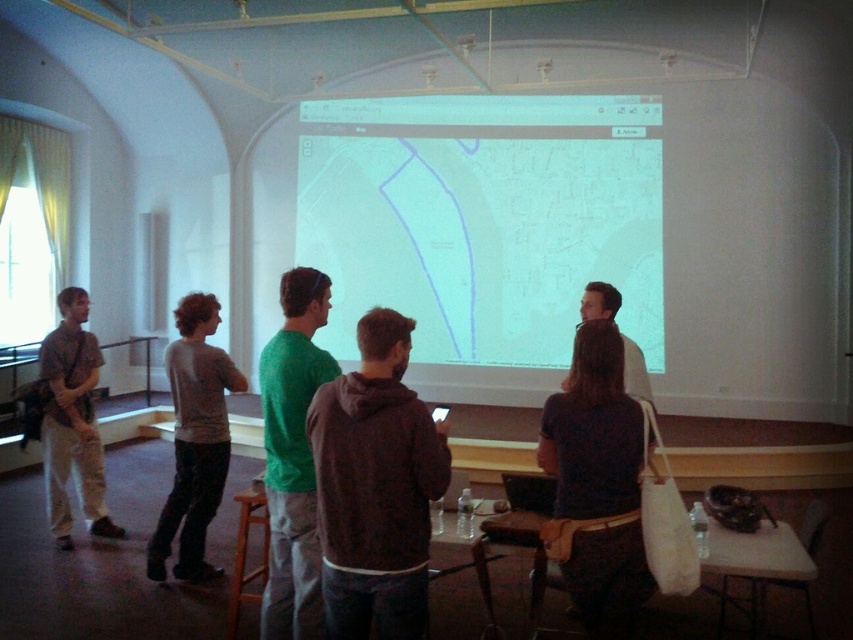
Question: Estimate the real-world distances between objects in this image. Which object is farther from the light brown cotton pants at left?

Choices:
 (A) dark blue shirt at center
 (B) white matte projection screen at center
 (C) gray cotton sweater at center

Answer: (B)

Question: Which point is farther to the camera?

Choices:
 (A) gray cotton sweater at center
 (B) light brown cotton pants at left
 (C) white matte projection screen at center

Answer: (C)

Question: Does green matte shirt at center have a lesser width compared to gray cotton sweater at center?

Choices:
 (A) yes
 (B) no

Answer: (A)

Question: Is white matte projection screen at center above dark blue shirt at center?

Choices:
 (A) yes
 (B) no

Answer: (A)

Question: Which of the following is the closest to the observer?

Choices:
 (A) (94, 381)
 (B) (200, 346)
 (C) (351, 428)
 (D) (561, 468)

Answer: (C)

Question: From the image, what is the correct spatial relationship of dark blue shirt at center in relation to green matte shirt at center?

Choices:
 (A) below
 (B) above

Answer: (A)